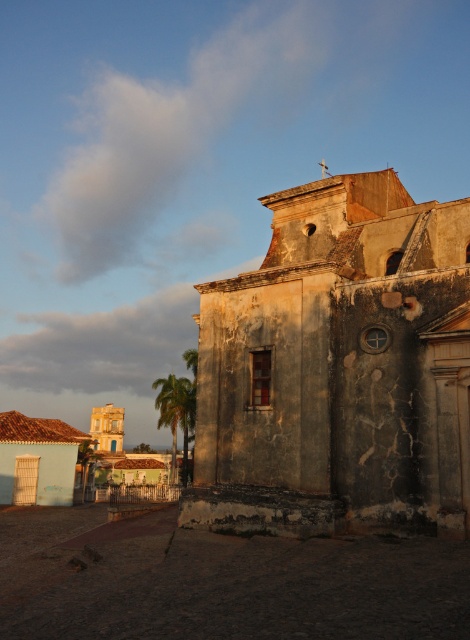
Does cracked stone church at center lie in front of green leafy palm tree at lower left?

Yes, it is in front of green leafy palm tree at lower left.

Is cracked stone church at center bigger than green leafy palm tree at lower left?

No, cracked stone church at center is not bigger than green leafy palm tree at lower left.

The height and width of the screenshot is (640, 470). Find the location of `cracked stone church at center`. cracked stone church at center is located at coordinates (337, 369).